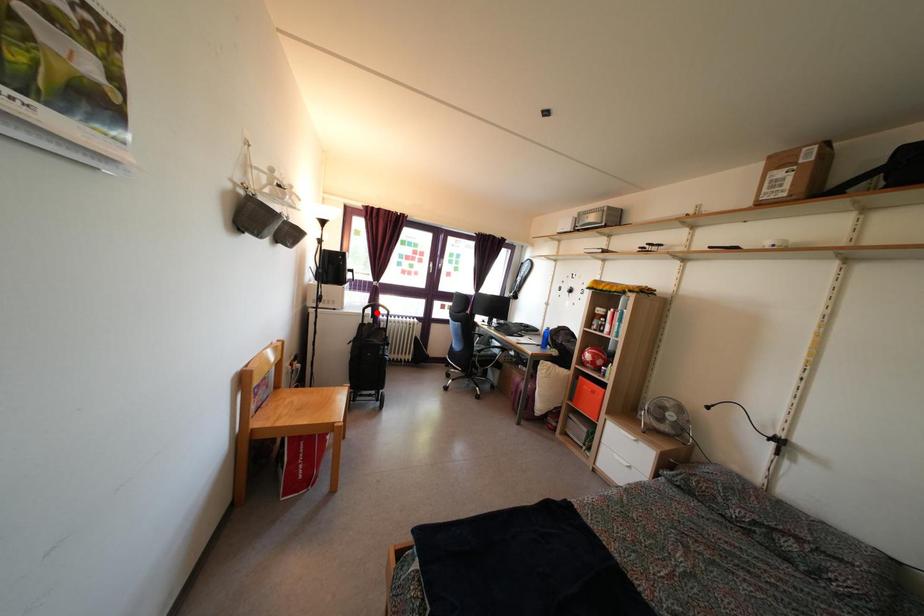
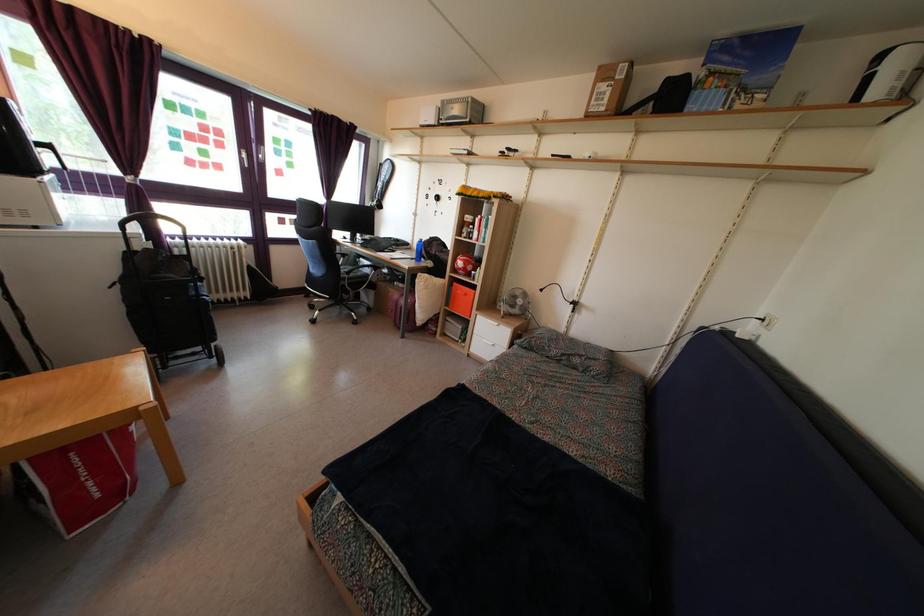
Question: I am providing you with two images of the same scene from different viewpoints. In image1, a red point is highlighted. Considering the same 3D point in image2, which of the following is correct?

Choices:
 (A) It is closer
 (B) It is farther

Answer: (B)